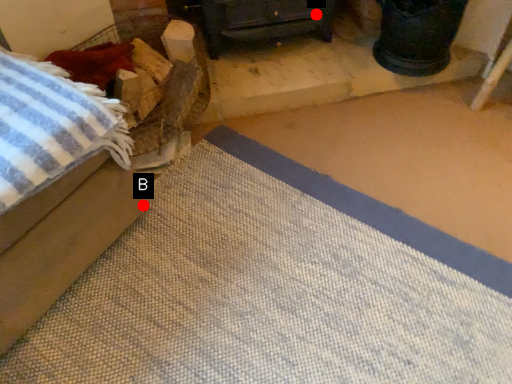
Question: Two points are circled on the image, labeled by A and B beside each circle. Among these points, which one is farthest from the camera?

Choices:
 (A) A is further
 (B) B is further

Answer: (A)